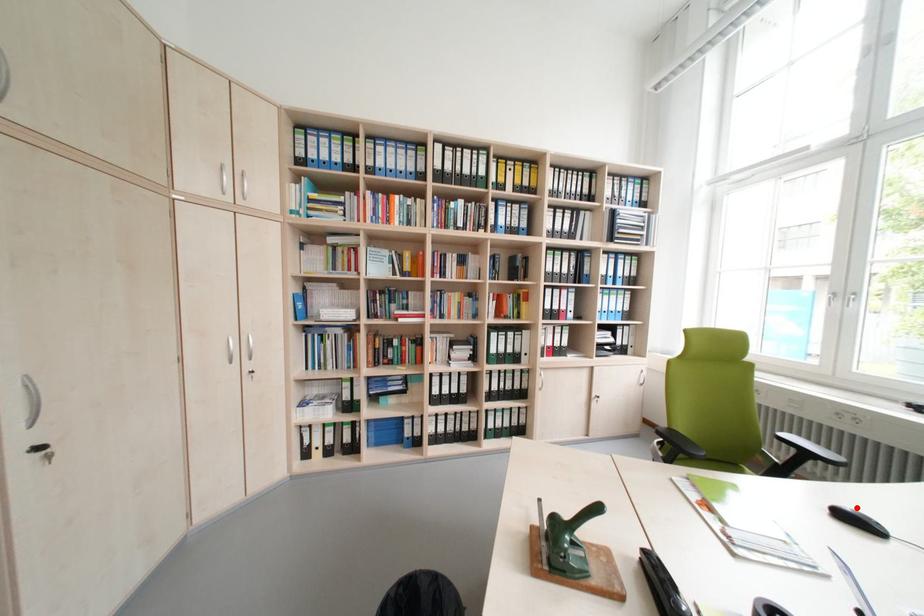
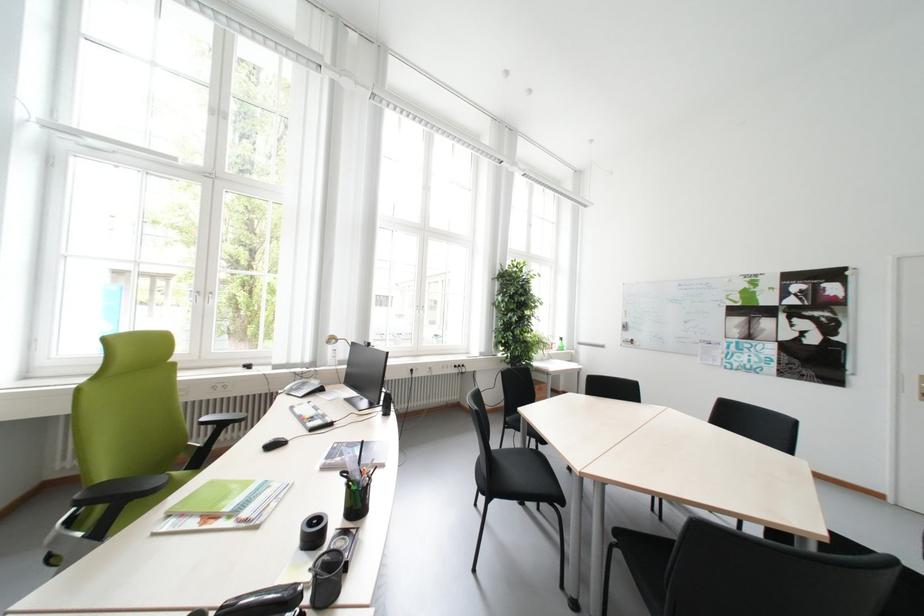
Find the pixel in the second image that matches the highlighted location in the first image.

(277, 442)